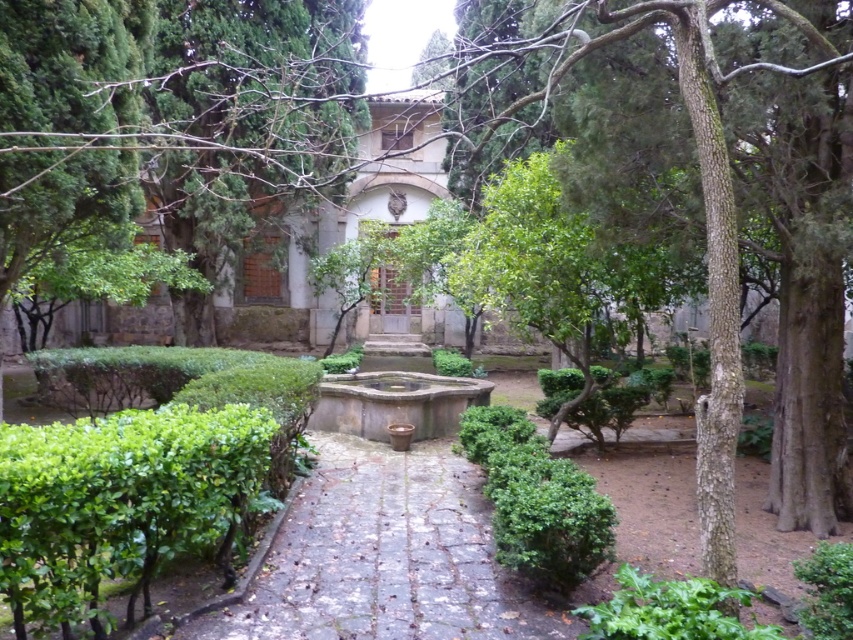
You are standing in the courtyard and want to take a photo of both the green rough bark tree at center and the stone fountain at center. Which object should you focus on first to ensure both are in clear view?

You should focus on the green rough bark tree at center first because it is closer to you than the stone fountain at center, ensuring both are in clear view.

From the picture: You are standing in the courtyard and want to take a photo of both the green rough bark tree at center and the stone fountain at center. Which object should you position to your left to include both in the frame?

You should position the stone fountain at center to your left because the green rough bark tree at center is to the right of the stone fountain at center, so placing the fountain on your left will keep both in the frame.